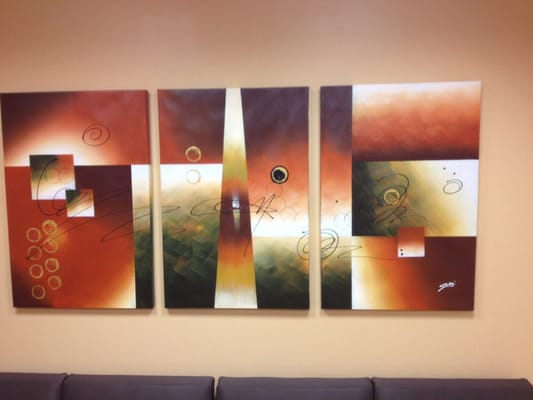
Find the location of `abstract art`. abstract art is located at coordinates (411, 120).